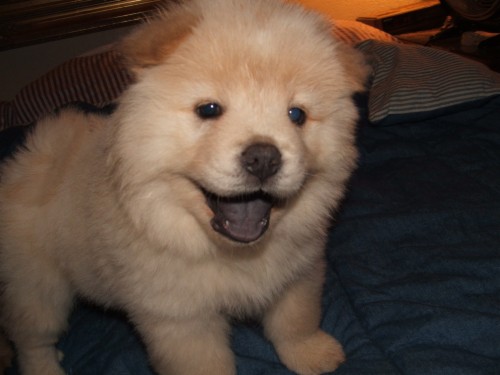
Identify the location of pillow. This screenshot has width=500, height=375. (418, 113).